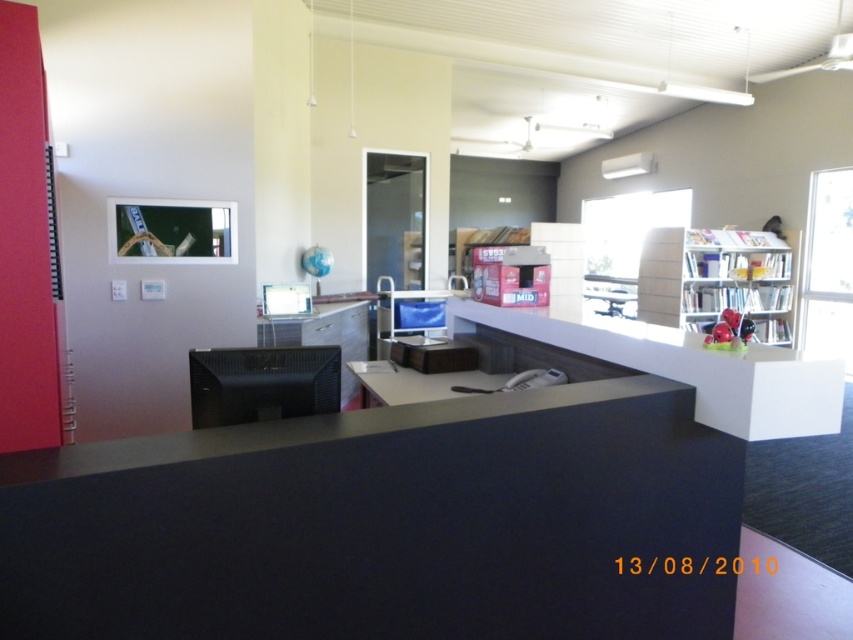
Question: Is matte black desk at center above white glossy counter top at center?

Choices:
 (A) no
 (B) yes

Answer: (A)

Question: Is matte black desk at center closer to the viewer compared to white glossy counter top at center?

Choices:
 (A) yes
 (B) no

Answer: (A)

Question: Which point appears closest to the camera in this image?

Choices:
 (A) [277, 294]
 (B) [213, 355]
 (C) [805, 404]

Answer: (B)

Question: Does matte black desk at center appear on the right side of white glossy counter top at center?

Choices:
 (A) no
 (B) yes

Answer: (A)

Question: Which of these objects is positioned farthest from the matte black desk at center?

Choices:
 (A) black matte monitor at center
 (B) black plastic computer at center

Answer: (B)

Question: Which point is closer to the camera?

Choices:
 (A) matte black desk at center
 (B) black matte monitor at center
 (C) white glossy counter top at center

Answer: (A)